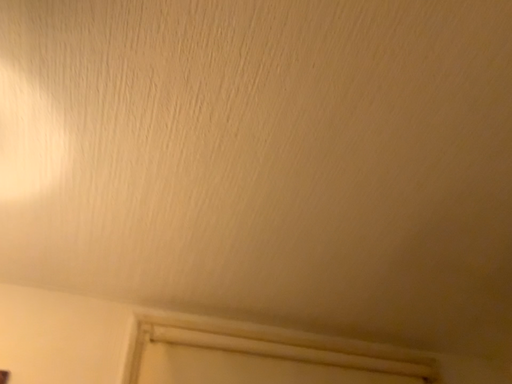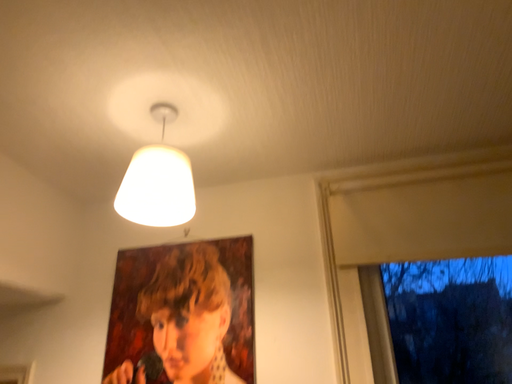
Question: Which way did the camera rotate in the video?

Choices:
 (A) rotated downward
 (B) rotated upward

Answer: (A)